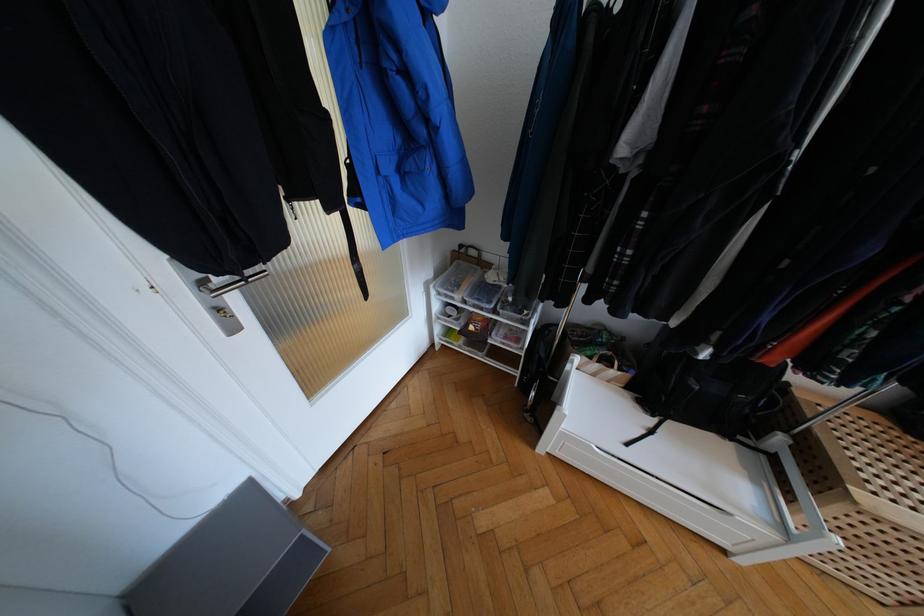
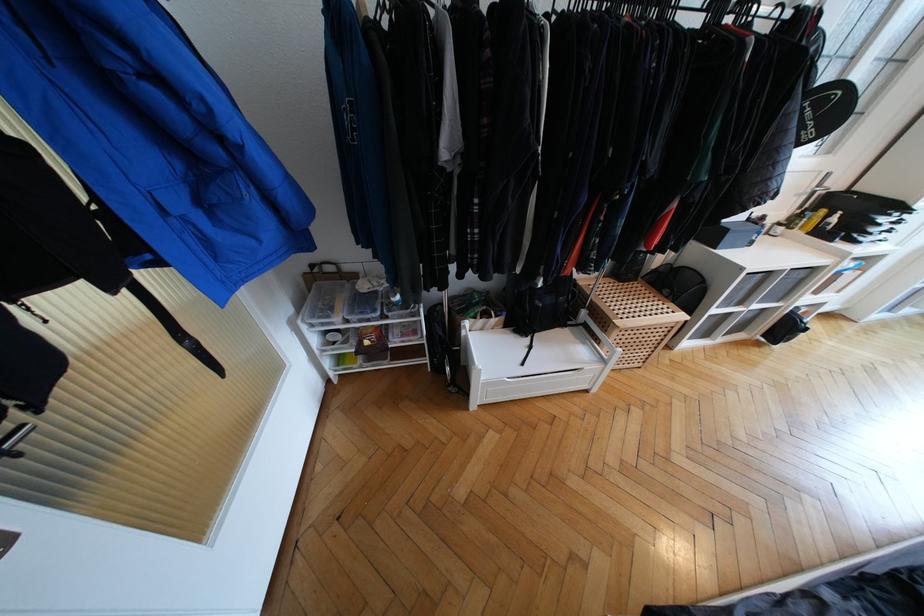
In the second image, find the point that corresponds to point 268,273 in the first image.

(25, 428)